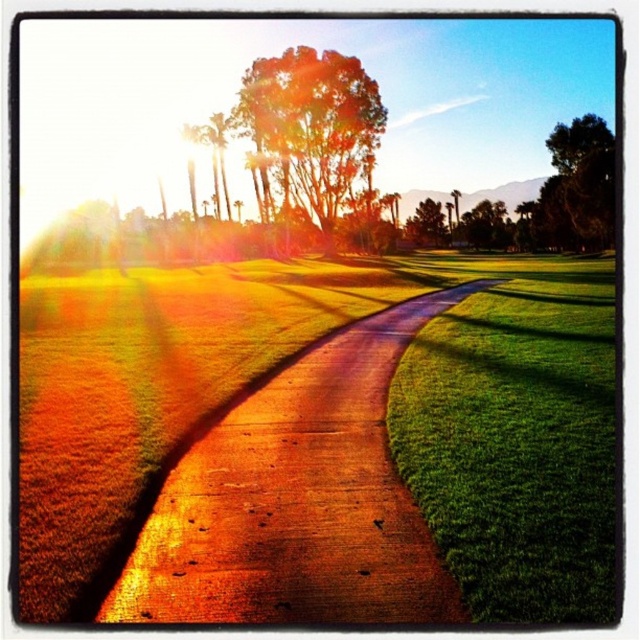
Between point (440, 323) and point (353, 449), which one is positioned behind?

Point (440, 323)

Between green soft grass at center and dirt track at center, which one appears on the right side from the viewer's perspective?

green soft grass at center

Consider the image. Who is more forward, (592, 566) or (369, 531)?

Positioned in front is point (592, 566).

This screenshot has width=640, height=640. What are the coordinates of `green soft grass at center` in the screenshot? It's located at (516, 436).

Can you confirm if green soft grass at center is smaller than green leafy tree at upper center?

Indeed, green soft grass at center has a smaller size compared to green leafy tree at upper center.

Which of these two, green soft grass at center or green leafy tree at upper center, stands shorter?

With less height is green soft grass at center.

Which is behind, point (506, 284) or point (305, 128)?

Positioned behind is point (305, 128).

This screenshot has width=640, height=640. In order to click on green soft grass at center in this screenshot , I will do `click(516, 436)`.

What are the coordinates of `green leafy tree at upper center` in the screenshot? It's located at (314, 131).

Who is taller, green leafy tree at upper center or green leafy tree at center?

green leafy tree at upper center

The image size is (640, 640). Identify the location of green leafy tree at upper center. (314, 131).